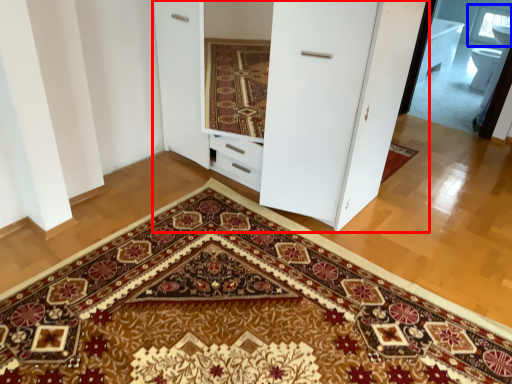
Question: Which object appears farthest to the camera in this image, dresser (highlighted by a red box) or window (highlighted by a blue box)?

Choices:
 (A) dresser
 (B) window

Answer: (B)